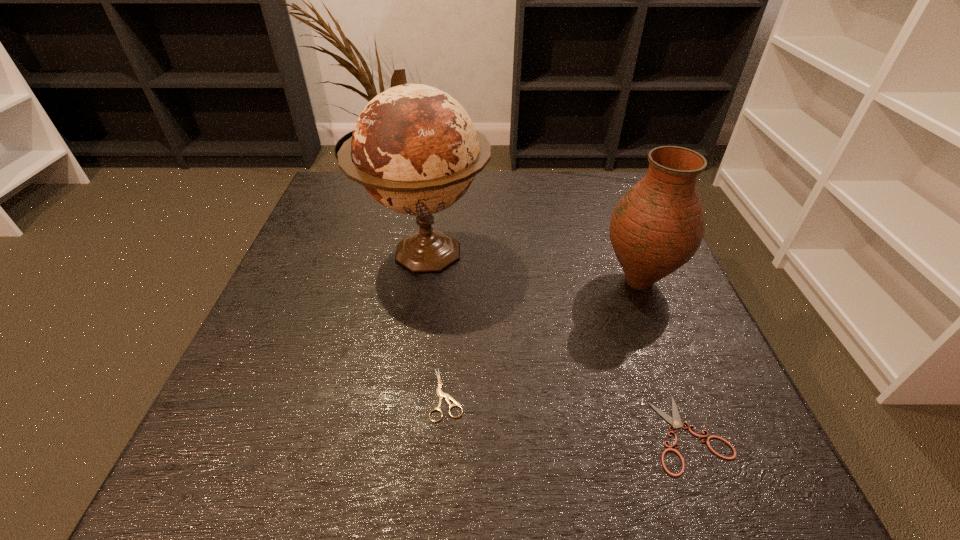
Identify which object is the closest to the left shears. Please provide its 2D coordinates. Your answer should be formatted as a tuple, i.e. [(x, y)], where the tuple contains the x and y coordinates of a point satisfying the conditions above.

[(414, 148)]

Locate an element on the screen. The height and width of the screenshot is (540, 960). object that is the closest one to the left shears is located at coordinates (414, 148).

You are a GUI agent. You are given a task and a screenshot of the screen. Output one action in this format:
    pyautogui.click(x=<x>, y=<y>)
    Task: Click on the blank area in the image that satisfies the following two spatial constraints: 1. on the front of the tallest object showing Asia; 2. on the right side of the left shears
    This screenshot has width=960, height=540.
    Given the screenshot: What is the action you would take?
    pyautogui.click(x=405, y=394)

At what (x,y) coordinates should I click in order to perform the action: click on vacant region that satisfies the following two spatial constraints: 1. on the front of the left shears showing Asia; 2. on the left side of the globe. Please return your answer as a coordinate pair (x, y). Looking at the image, I should click on (405, 394).

Locate an element on the screen. The height and width of the screenshot is (540, 960). free region that satisfies the following two spatial constraints: 1. on the front of the globe showing Asia; 2. on the left side of the left shears is located at coordinates (405, 394).

Image resolution: width=960 pixels, height=540 pixels. Find the location of `free space that satisfies the following two spatial constraints: 1. on the front of the right shears showing Asia; 2. on the left side of the globe`. free space that satisfies the following two spatial constraints: 1. on the front of the right shears showing Asia; 2. on the left side of the globe is located at coordinates (399, 434).

At what (x,y) coordinates should I click in order to perform the action: click on free region that satisfies the following two spatial constraints: 1. on the front of the left shears showing Asia; 2. on the right side of the globe. Please return your answer as a coordinate pair (x, y). Looking at the image, I should click on (405, 394).

At what (x,y) coordinates should I click in order to perform the action: click on free space that satisfies the following two spatial constraints: 1. on the front of the third shortest object showing Asia; 2. on the right side of the globe. Please return your answer as a coordinate pair (x, y). Looking at the image, I should click on (421, 281).

Locate an element on the screen. Image resolution: width=960 pixels, height=540 pixels. free space that satisfies the following two spatial constraints: 1. on the front of the tallest object showing Asia; 2. on the right side of the right shears is located at coordinates point(399,434).

I want to click on blank area in the image that satisfies the following two spatial constraints: 1. on the front of the tallest object showing Asia; 2. on the left side of the left shears, so click(405, 394).